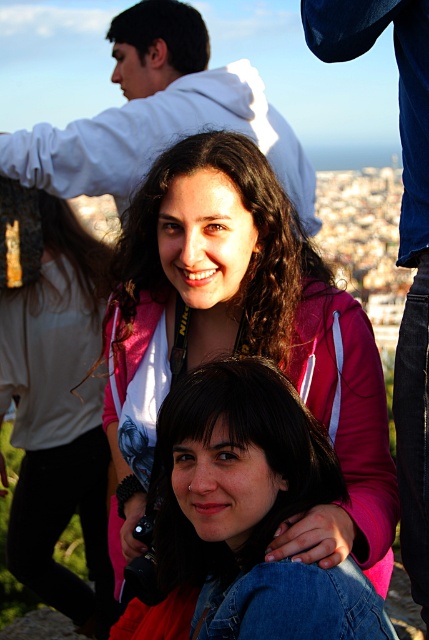
The width and height of the screenshot is (429, 640). Find the location of `pink fleece jacket at center`. pink fleece jacket at center is located at coordinates (242, 340).

Can you confirm if pink fleece jacket at center is bigger than white hoodie at upper center?

Incorrect, pink fleece jacket at center is not larger than white hoodie at upper center.

Describe the element at coordinates (242, 340) in the screenshot. This screenshot has height=640, width=429. I see `pink fleece jacket at center` at that location.

At what (x,y) coordinates should I click in order to perform the action: click on pink fleece jacket at center. Please return your answer as a coordinate pair (x, y). This screenshot has height=640, width=429. Looking at the image, I should click on click(242, 340).